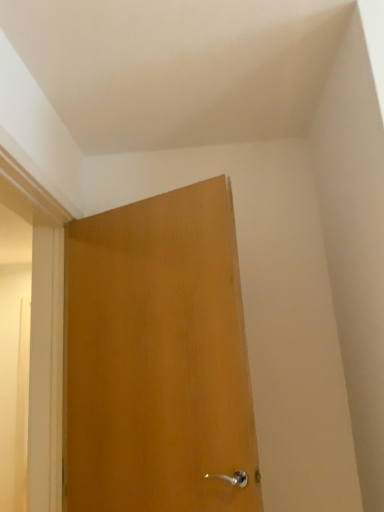
What is the approximate height of wooden door at center?

wooden door at center is 4.04 feet in height.

Describe the element at coordinates (158, 358) in the screenshot. Image resolution: width=384 pixels, height=512 pixels. I see `wooden door at center` at that location.

Identify the location of wooden door at center. The height and width of the screenshot is (512, 384). (158, 358).

Identify the location of wooden door at center. click(x=158, y=358).